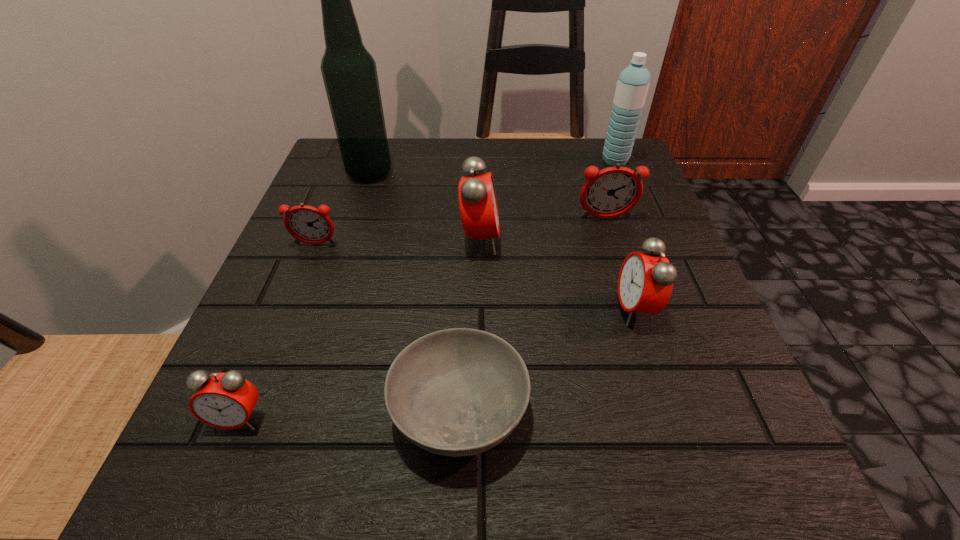
Where is `unoccupied position between the alcohol and the farthest red alarm clock`? This screenshot has height=540, width=960. unoccupied position between the alcohol and the farthest red alarm clock is located at coordinates (424, 206).

Identify the location of free space between the left reddish-pink alarm clock and the rightmost red alarm clock. The width and height of the screenshot is (960, 540). (475, 277).

Locate an element on the screen. The image size is (960, 540). empty space between the second red alarm clock from right to left and the bigger reddish-pink alarm clock is located at coordinates (542, 230).

The height and width of the screenshot is (540, 960). I want to click on free spot between the tallest object and the leftmost red alarm clock, so click(x=304, y=295).

Locate an element on the screen. free spot between the smaller reddish-pink alarm clock and the farther reddish-pink alarm clock is located at coordinates (461, 232).

Image resolution: width=960 pixels, height=540 pixels. I want to click on free space that is in between the alcohol and the bowl, so click(x=415, y=291).

Locate an element on the screen. unoccupied area between the alcohol and the smaller reddish-pink alarm clock is located at coordinates (343, 208).

Find the location of a particular element. This screenshot has width=960, height=540. vacant area that lies between the second farthest red alarm clock and the blue water bottle is located at coordinates (625, 234).

Find the location of a particular element. The image size is (960, 540). free area in between the rightmost red alarm clock and the second red alarm clock from right to left is located at coordinates (558, 274).

Identify the location of the second closest object relative to the right reddish-pink alarm clock. tap(645, 283).